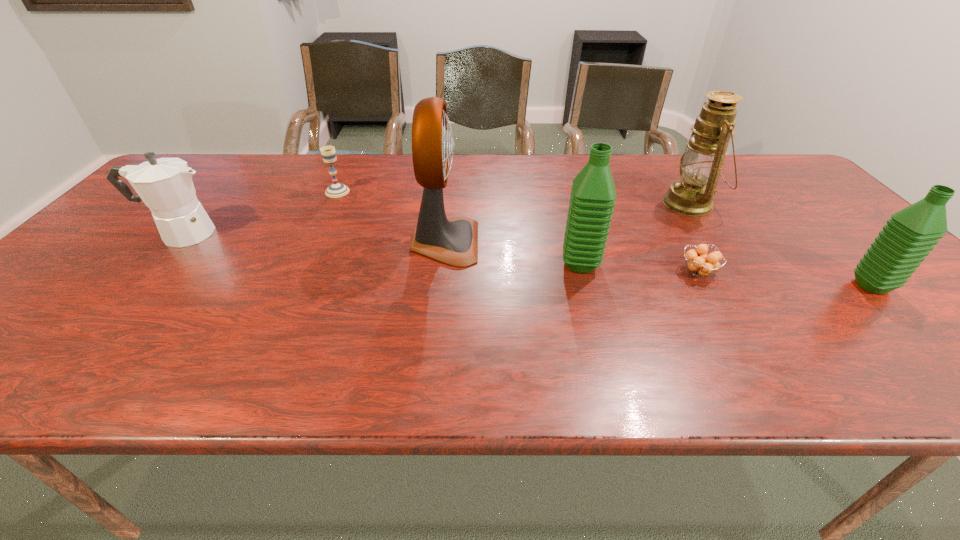
At what (x,y) coordinates should I click in order to perform the action: click on free space between the fan and the sixth tallest object. Please return your answer as a coordinate pair (x, y). Looking at the image, I should click on (391, 217).

At what (x,y) coordinates should I click in order to perform the action: click on free space between the left water bottle and the fifth object from right to left. Please return your answer as a coordinate pair (x, y). The image size is (960, 540). Looking at the image, I should click on (513, 253).

You are a GUI agent. You are given a task and a screenshot of the screen. Output one action in this format:
    pyautogui.click(x=<x>, y=<y>)
    Task: Click on the free spot between the sixth tallest object and the orange fruit
    
    Given the screenshot: What is the action you would take?
    pyautogui.click(x=518, y=232)

Find the location of a particular element. The width and height of the screenshot is (960, 540). vacant space in between the fan and the coffeepot is located at coordinates (313, 238).

Identify the location of object that is the sixth nearest to the fourth object from right to left. (165, 185).

This screenshot has height=540, width=960. What are the coordinates of `object that can be found as the fourth closest to the right water bottle` in the screenshot? It's located at (454, 241).

Identify the location of free space that satisfies the following two spatial constraints: 1. on the front side of the oil lamp; 2. on the front-facing side of the third object from left to right. (716, 242).

This screenshot has width=960, height=540. In order to click on free spot that satisfies the following two spatial constraints: 1. on the front-facing side of the fan; 2. on the back side of the shortest object in this screenshot , I will do `click(442, 272)`.

Identify the location of free space that satisfies the following two spatial constraints: 1. on the front-facing side of the fifth object from right to left; 2. on the left side of the right water bottle. (441, 286).

Where is `vacant area that satisfies the following two spatial constraints: 1. on the front side of the shortest object; 2. on the left side of the left water bottle`? The width and height of the screenshot is (960, 540). vacant area that satisfies the following two spatial constraints: 1. on the front side of the shortest object; 2. on the left side of the left water bottle is located at coordinates (582, 272).